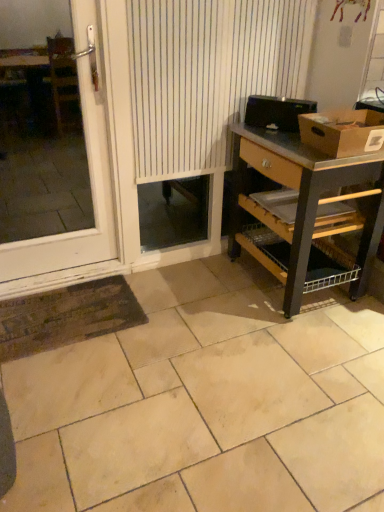
Where is `beige ceramic tile at center`? Image resolution: width=384 pixels, height=512 pixels. beige ceramic tile at center is located at coordinates (207, 403).

This screenshot has height=512, width=384. Find the location of `wooden desk at right`. wooden desk at right is located at coordinates click(305, 202).

Locate an element on the screen. Image resolution: width=384 pixels, height=512 pixels. white plastic door at left is located at coordinates pos(93,206).

From a real-world perspective, is brown cardboard box at upper right located higher than beige ceramic tile at center?

Yes, from a real-world perspective, brown cardboard box at upper right is above beige ceramic tile at center.

Considering the positions of objects brown cardboard box at upper right and beige ceramic tile at center in the image provided, who is behind, brown cardboard box at upper right or beige ceramic tile at center?

Positioned behind is brown cardboard box at upper right.

Between brown cardboard box at upper right and beige ceramic tile at center, which one has smaller width?

With smaller width is brown cardboard box at upper right.

Is brown cardboard box at upper right situated inside beige ceramic tile at center or outside?

brown cardboard box at upper right is located beyond the bounds of beige ceramic tile at center.

Identify the location of desk lying behind the white plastic door at left. Image resolution: width=384 pixels, height=512 pixels. (305, 202).

How much distance is there between wooden desk at right and white plastic door at left?

38.19 inches.

From the image's perspective, is wooden desk at right located above or below white plastic door at left?

wooden desk at right is below white plastic door at left.

Is wooden desk at right located outside white plastic door at left?

wooden desk at right is positioned outside white plastic door at left.

Looking at this image, from the image's perspective, between brown cardboard box at upper right and white striped curtain at center, who is located below?

brown cardboard box at upper right, from the image's perspective.

Is brown cardboard box at upper right with white striped curtain at center?

No, brown cardboard box at upper right is not touching white striped curtain at center.

From a real-world perspective, is brown cardboard box at upper right physically located above or below white striped curtain at center?

brown cardboard box at upper right is situated lower than white striped curtain at center in the real world.

Is white plastic door at left not close to brown cardboard box at upper right?

Yes.

Considering the sizes of objects white plastic door at left and brown cardboard box at upper right in the image provided, who is bigger, white plastic door at left or brown cardboard box at upper right?

white plastic door at left.

Is brown cardboard box at upper right located within white plastic door at left?

No, brown cardboard box at upper right is not inside white plastic door at left.

Find the location of a particular element. The height and width of the screenshot is (512, 384). window in front of the white striped curtain at center is located at coordinates (93, 206).

Which object is more forward, white striped curtain at center or white plastic door at left?

white plastic door at left is more forward.

Does point (164, 76) come farther from viewer compared to point (82, 58)?

No, it is not.

In terms of size, does white striped curtain at center appear bigger or smaller than white plastic door at left?

Clearly, white striped curtain at center is larger in size than white plastic door at left.

Considering the sizes of objects white striped curtain at center and brown cardboard box at upper right in the image provided, who is shorter, white striped curtain at center or brown cardboard box at upper right?

brown cardboard box at upper right.

In order to click on box lying in front of the white striped curtain at center in this screenshot , I will do `click(343, 132)`.

Considering the positions of objects white striped curtain at center and brown cardboard box at upper right in the image provided, who is in front, white striped curtain at center or brown cardboard box at upper right?

Positioned in front is brown cardboard box at upper right.

Is white striped curtain at center directly adjacent to brown cardboard box at upper right?

No, white striped curtain at center is not next to brown cardboard box at upper right.

Considering the relative sizes of wooden desk at right and white striped curtain at center in the image provided, is wooden desk at right bigger than white striped curtain at center?

Yes, wooden desk at right is bigger than white striped curtain at center.

From a real-world perspective, between wooden desk at right and white striped curtain at center, who is vertically higher?

From a 3D spatial view, white striped curtain at center is above.

Locate an element on the screen. desk that appears on the right of white striped curtain at center is located at coordinates (305, 202).

Between point (340, 186) and point (146, 170), which one is positioned in front?

The point (340, 186) is in front.

You are a GUI agent. You are given a task and a screenshot of the screen. Output one action in this format:
    pyautogui.click(x=<x>, y=<y>)
    Task: Click on the ceramic tile below the brown cardboard box at upper right (from a real-world perspective)
    The width and height of the screenshot is (384, 512).
    Given the screenshot: What is the action you would take?
    tap(207, 403)

The height and width of the screenshot is (512, 384). What are the coordinates of `desk on the right of white plastic door at left` in the screenshot? It's located at (305, 202).

Estimate the real-world distances between objects in this image. Which object is closer to wooden desk at right, beige ceramic tile at center or white striped curtain at center?

white striped curtain at center is closer to wooden desk at right.

Based on the photo, looking at the image, which one is located further to brown cardboard box at upper right, beige ceramic tile at center or white striped curtain at center?

The object further to brown cardboard box at upper right is beige ceramic tile at center.

When comparing their distances from white striped curtain at center, does beige ceramic tile at center or wooden desk at right seem further?

beige ceramic tile at center is positioned further to the anchor white striped curtain at center.

Which object lies nearer to the anchor point brown cardboard box at upper right, beige ceramic tile at center or wooden desk at right?

Based on the image, wooden desk at right appears to be nearer to brown cardboard box at upper right.

Looking at the image, which one is located further to brown cardboard box at upper right, white striped curtain at center or white plastic door at left?

The object further to brown cardboard box at upper right is white plastic door at left.

Consider the image. Considering their positions, is brown cardboard box at upper right positioned closer to white plastic door at left than white striped curtain at center?

white striped curtain at center is positioned closer to the anchor white plastic door at left.

From the image, which object appears to be farther from wooden desk at right, beige ceramic tile at center or white plastic door at left?

white plastic door at left.

Which object lies nearer to the anchor point white plastic door at left, white striped curtain at center or wooden desk at right?

white striped curtain at center is positioned closer to the anchor white plastic door at left.

The image size is (384, 512). In order to click on desk between white striped curtain at center and beige ceramic tile at center in the vertical direction in this screenshot , I will do `click(305, 202)`.

Find the location of a particular element. The image size is (384, 512). box between white striped curtain at center and wooden desk at right vertically is located at coordinates (343, 132).

What are the coordinates of `desk between white plastic door at left and brown cardboard box at upper right from left to right` in the screenshot? It's located at (305, 202).

I want to click on window that lies between white striped curtain at center and beige ceramic tile at center from top to bottom, so click(93, 206).